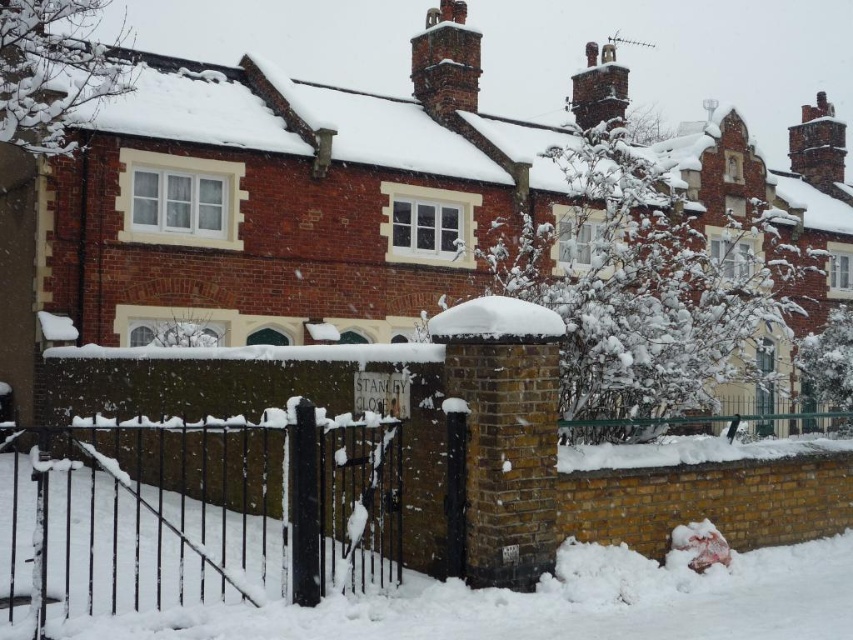
Is black wrought iron gate at lower center further to camera compared to white fluffy snow at lower left?

Yes, it is behind white fluffy snow at lower left.

Locate an element on the screen. Image resolution: width=853 pixels, height=640 pixels. black wrought iron gate at lower center is located at coordinates [x=141, y=520].

This screenshot has height=640, width=853. What are the coordinates of `black wrought iron gate at lower center` in the screenshot? It's located at (141, 520).

At what (x,y) coordinates should I click in order to perform the action: click on black wrought iron gate at lower center. Please return your answer as a coordinate pair (x, y). The width and height of the screenshot is (853, 640). Looking at the image, I should click on (141, 520).

Does black wrought iron gate at lower center have a lesser height compared to white fluffy snow at center?

Incorrect, black wrought iron gate at lower center's height does not fall short of white fluffy snow at center's.

Between point (235, 550) and point (556, 317), which one is positioned behind?

Positioned behind is point (235, 550).

The width and height of the screenshot is (853, 640). What are the coordinates of `black wrought iron gate at lower center` in the screenshot? It's located at (141, 520).

Which is more to the left, black wrought iron gate at center or white fluffy snow at lower left?

From the viewer's perspective, black wrought iron gate at center appears more on the left side.

Does point (183, 595) come closer to viewer compared to point (418, 576)?

Yes, it is in front of point (418, 576).

Find the location of a particular element. The height and width of the screenshot is (640, 853). black wrought iron gate at center is located at coordinates pyautogui.click(x=196, y=512).